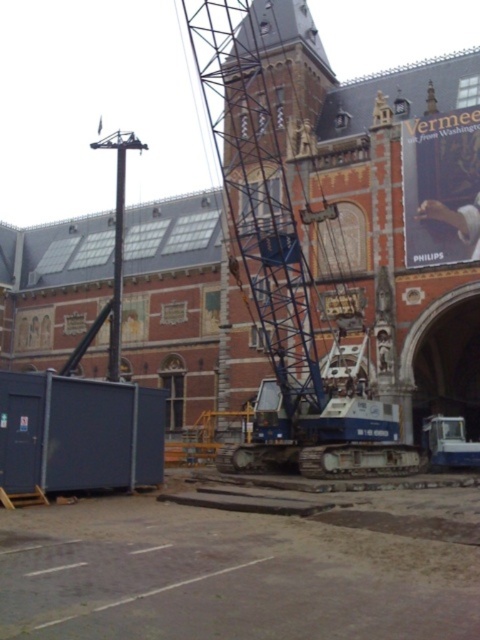
Which is more to the left, metallic blue container at lower left or metallic blue crane at center?

metallic blue container at lower left

Between metallic blue container at lower left and metallic blue crane at center, which one is positioned lower?

metallic blue crane at center is below.

What are the coordinates of `metallic blue container at lower left` in the screenshot? It's located at (79, 433).

Consider the image. Does blue metallic crane at center have a smaller size compared to metallic blue container at lower left?

Actually, blue metallic crane at center might be larger than metallic blue container at lower left.

The width and height of the screenshot is (480, 640). Identify the location of blue metallic crane at center. (284, 280).

The width and height of the screenshot is (480, 640). Describe the element at coordinates (284, 280) in the screenshot. I see `blue metallic crane at center` at that location.

Can you confirm if blue metallic crane at center is positioned above metallic blue crane at center?

Indeed, blue metallic crane at center is positioned over metallic blue crane at center.

This screenshot has width=480, height=640. What are the coordinates of `blue metallic crane at center` in the screenshot? It's located at (284, 280).